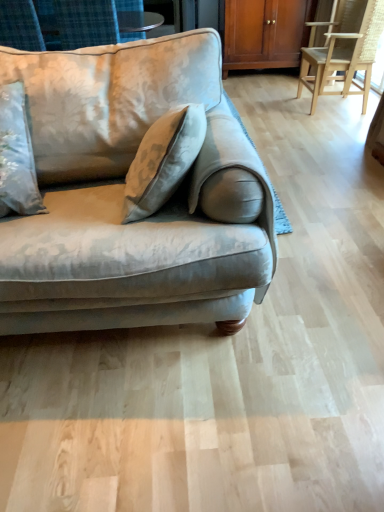
Question: Considering the positions of velvet beige couch at left and light brown wooden chair at right in the image, is velvet beige couch at left bigger or smaller than light brown wooden chair at right?

Choices:
 (A) small
 (B) big

Answer: (B)

Question: Considering the positions of velvet beige couch at left and light brown wooden chair at right in the image, is velvet beige couch at left wider or thinner than light brown wooden chair at right?

Choices:
 (A) thin
 (B) wide

Answer: (B)

Question: Which of these objects is positioned closest to the velvet beige couch at left?

Choices:
 (A) wooden cabinet at upper center
 (B) light brown wooden chair at right

Answer: (B)

Question: Which object is positioned closest to the wooden cabinet at upper center?

Choices:
 (A) velvet beige couch at left
 (B) light brown wooden chair at right

Answer: (B)